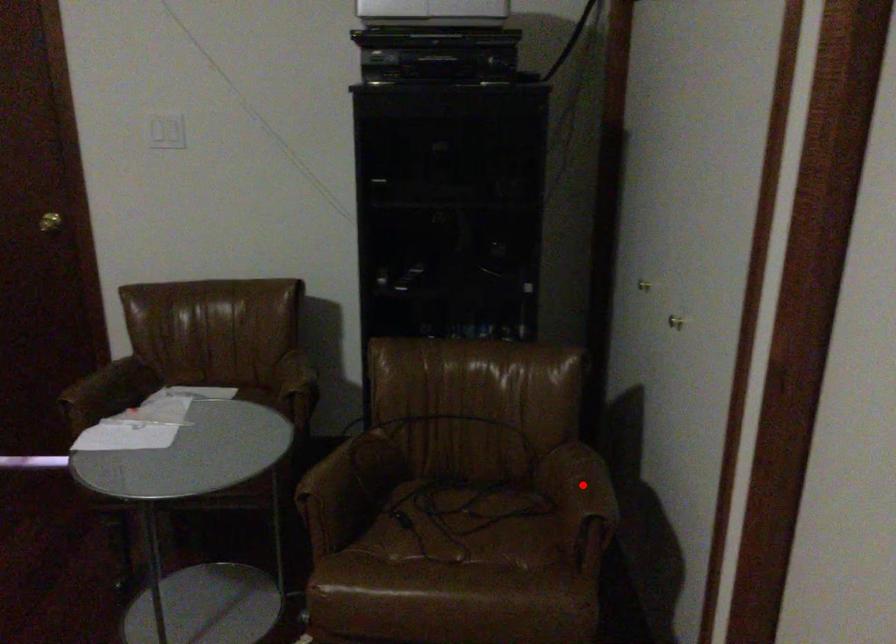
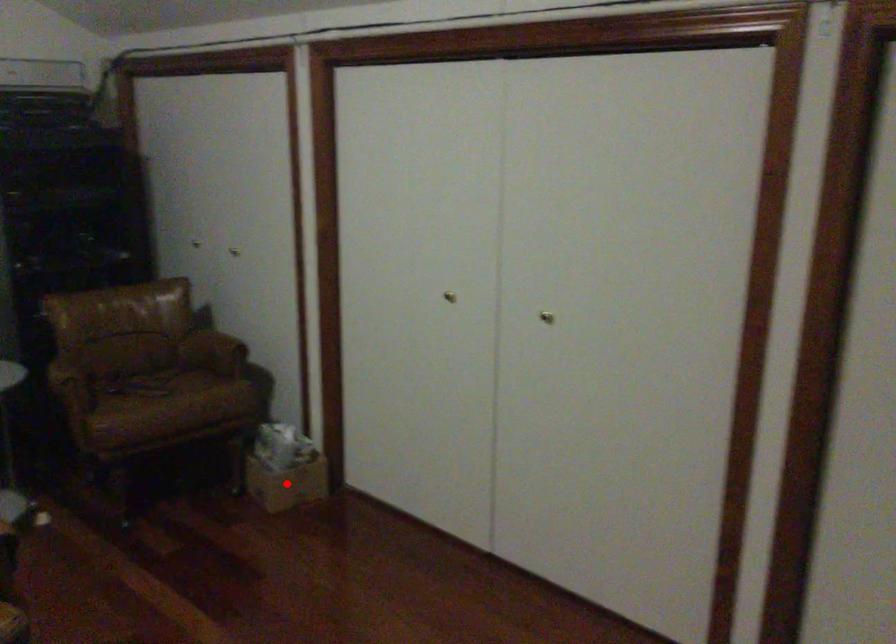
I am providing you with two images of the same scene from different viewpoints. A red point is marked on the first image and another point is marked on the second image. Is the red point in image1 aligned with the point shown in image2?

No